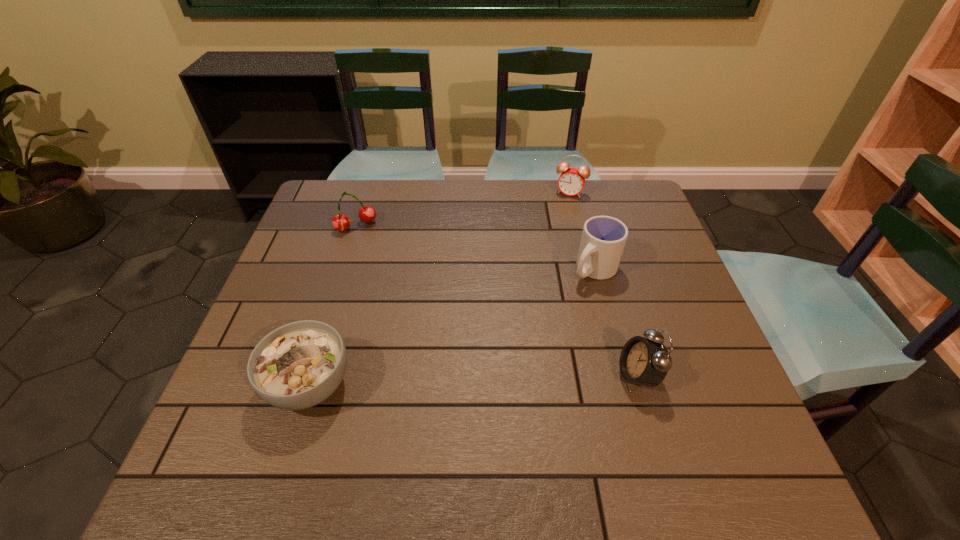
Identify the location of vacant space at the near edge of the desktop. The height and width of the screenshot is (540, 960). (548, 429).

Identify the location of free space at the left edge. pyautogui.click(x=323, y=312).

Locate an element on the screen. The height and width of the screenshot is (540, 960). free spot at the right edge of the desktop is located at coordinates (649, 225).

I want to click on free space at the far right corner, so click(603, 210).

This screenshot has height=540, width=960. I want to click on vacant space at the near right corner of the desktop, so click(674, 420).

Locate an element on the screen. This screenshot has height=540, width=960. free spot between the nearer alarm clock and the soup bowl is located at coordinates (473, 380).

Where is `vacant region between the shortest object and the farthest object`? This screenshot has width=960, height=540. vacant region between the shortest object and the farthest object is located at coordinates (440, 288).

In order to click on vacant region between the soup bowl and the nearer alarm clock in this screenshot , I will do `click(473, 380)`.

Identify the location of free space between the cup and the soup bowl. (452, 327).

The width and height of the screenshot is (960, 540). I want to click on blank region between the second farthest object and the soup bowl, so click(x=333, y=305).